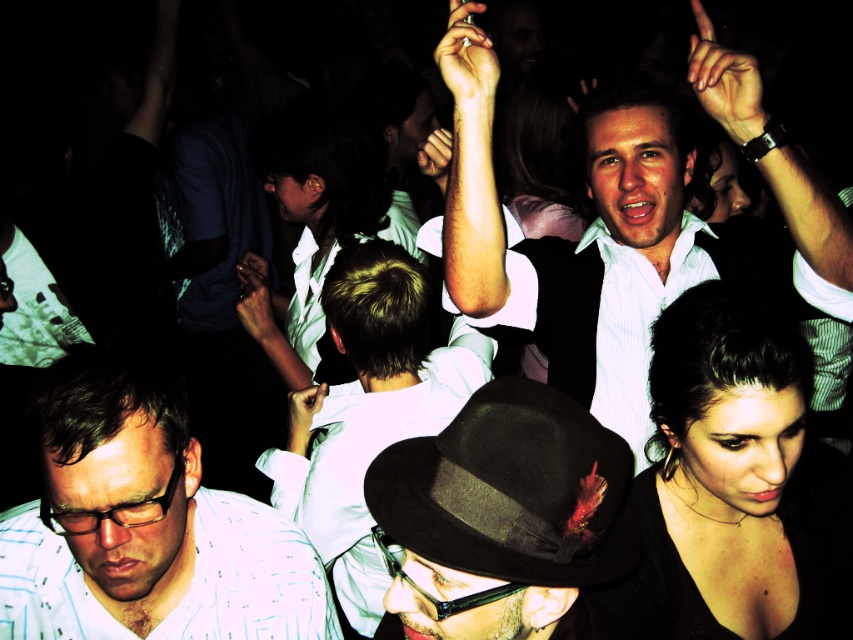
Question: Is black matte dress at lower right below matte white shirt at center?

Choices:
 (A) yes
 (B) no

Answer: (A)

Question: Which of the following is the closest to the observer?

Choices:
 (A) coord(370,289)
 (B) coord(312,104)
 (C) coord(498,388)
 (D) coord(247,589)

Answer: (C)

Question: In this image, where is black matte dress at lower right located relative to matte white shirt at center?

Choices:
 (A) right
 (B) left

Answer: (A)

Question: Which of the following is the closest to the observer?

Choices:
 (A) matte white shirt at center
 (B) white shirt at center

Answer: (A)

Question: Which of the following is the closest to the observer?

Choices:
 (A) (834, 456)
 (B) (105, 612)

Answer: (B)

Question: Is the position of white shirt at center less distant than that of white glossy shirt at center?

Choices:
 (A) yes
 (B) no

Answer: (A)